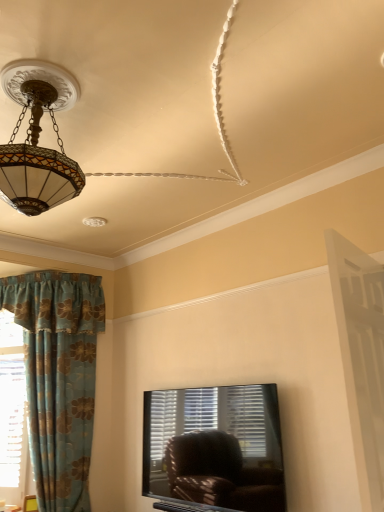
Question: From a real-world perspective, is white wooden screen door at right positioned over tiffany glass pendant light at upper left based on gravity?

Choices:
 (A) no
 (B) yes

Answer: (A)

Question: Is white wooden screen door at right shorter than tiffany glass pendant light at upper left?

Choices:
 (A) no
 (B) yes

Answer: (A)

Question: Is white wooden screen door at right far away from tiffany glass pendant light at upper left?

Choices:
 (A) no
 (B) yes

Answer: (B)

Question: Is white wooden screen door at right looking in the opposite direction of tiffany glass pendant light at upper left?

Choices:
 (A) no
 (B) yes

Answer: (A)

Question: Is white wooden screen door at right taller than tiffany glass pendant light at upper left?

Choices:
 (A) no
 (B) yes

Answer: (B)

Question: From the image's perspective, relative to blue floral fabric curtain at left, is white wooden screen door at right above or below?

Choices:
 (A) below
 (B) above

Answer: (B)

Question: Considering the positions of white wooden screen door at right and blue floral fabric curtain at left in the image, is white wooden screen door at right taller or shorter than blue floral fabric curtain at left?

Choices:
 (A) short
 (B) tall

Answer: (A)

Question: Which is correct: white wooden screen door at right is inside blue floral fabric curtain at left, or outside of it?

Choices:
 (A) inside
 (B) outside

Answer: (B)

Question: Is white wooden screen door at right in front of or behind blue floral fabric curtain at left in the image?

Choices:
 (A) front
 (B) behind

Answer: (A)

Question: From the image's perspective, is white wooden screen door at right above or below tiffany glass pendant light at upper left?

Choices:
 (A) below
 (B) above

Answer: (A)

Question: Is white wooden screen door at right taller or shorter than tiffany glass pendant light at upper left?

Choices:
 (A) tall
 (B) short

Answer: (A)

Question: Is white wooden screen door at right in front of or behind tiffany glass pendant light at upper left in the image?

Choices:
 (A) behind
 (B) front

Answer: (B)

Question: Is white wooden screen door at right bigger or smaller than tiffany glass pendant light at upper left?

Choices:
 (A) big
 (B) small

Answer: (B)

Question: Does point (41, 62) appear closer or farther from the camera than point (38, 104)?

Choices:
 (A) closer
 (B) farther

Answer: (A)

Question: Looking at the image, does tiffany glass pendant light at upper left seem bigger or smaller compared to matte glass chandelier at upper left?

Choices:
 (A) small
 (B) big

Answer: (A)